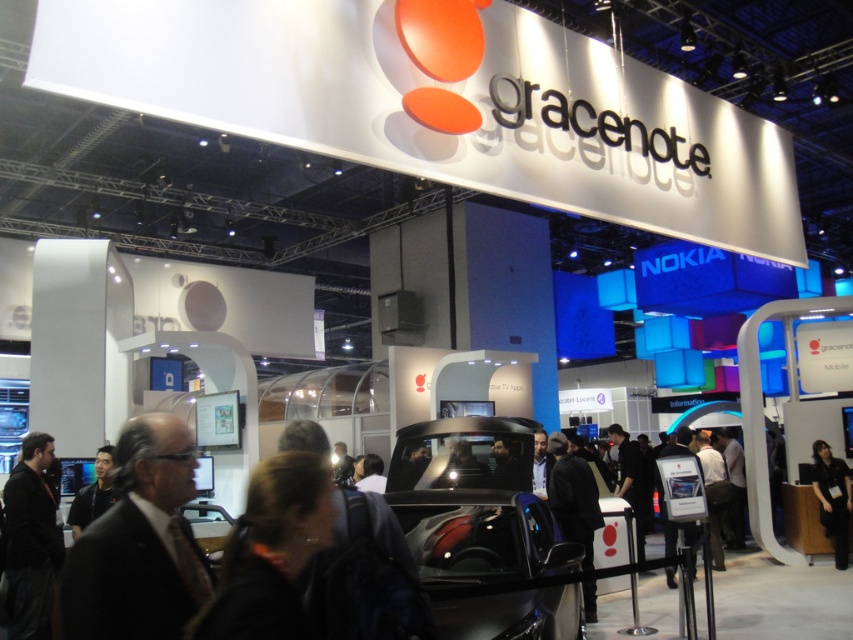
Question: Considering the relative positions of black suit at lower left and black fabric jacket at lower left in the image provided, where is black suit at lower left located with respect to black fabric jacket at lower left?

Choices:
 (A) above
 (B) below

Answer: (A)

Question: Considering the real-world distances, which object is closest to the black suit at lower left?

Choices:
 (A) black fabric shirt at lower right
 (B) black fabric jacket at lower left

Answer: (B)

Question: Is black suit at lower left bigger than black fabric shirt at lower right?

Choices:
 (A) no
 (B) yes

Answer: (A)

Question: Which point is farther to the camera?

Choices:
 (A) black suit at lower left
 (B) black fabric shirt at lower right

Answer: (B)

Question: Does black suit at lower left have a smaller size compared to black fabric shirt at lower right?

Choices:
 (A) no
 (B) yes

Answer: (B)

Question: Which point appears closest to the camera in this image?

Choices:
 (A) (7, 524)
 (B) (827, 531)

Answer: (A)